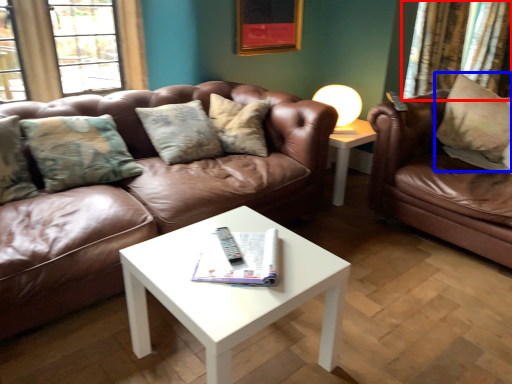
Question: Which object is further to the camera taking this photo, curtain (highlighted by a red box) or pillow (highlighted by a blue box)?

Choices:
 (A) curtain
 (B) pillow

Answer: (A)